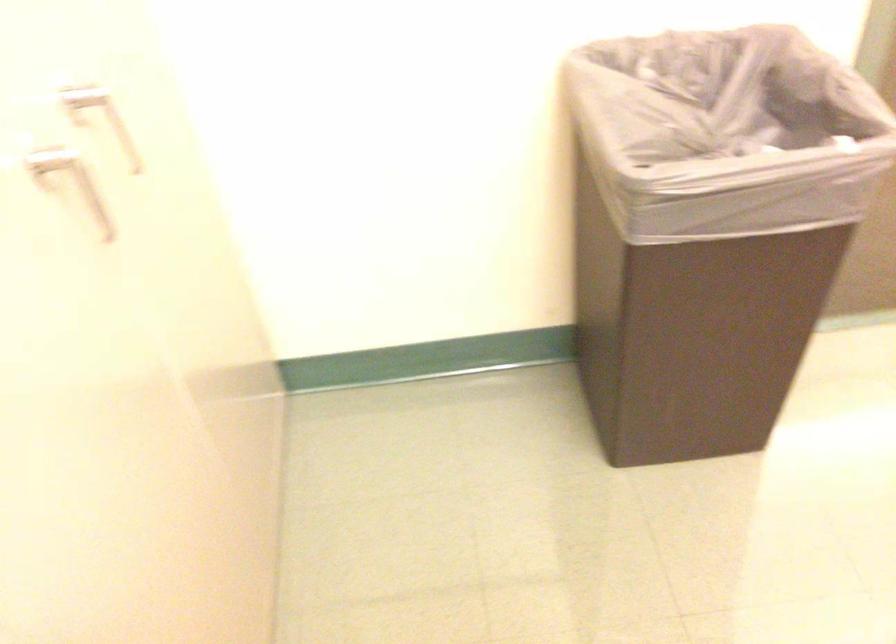
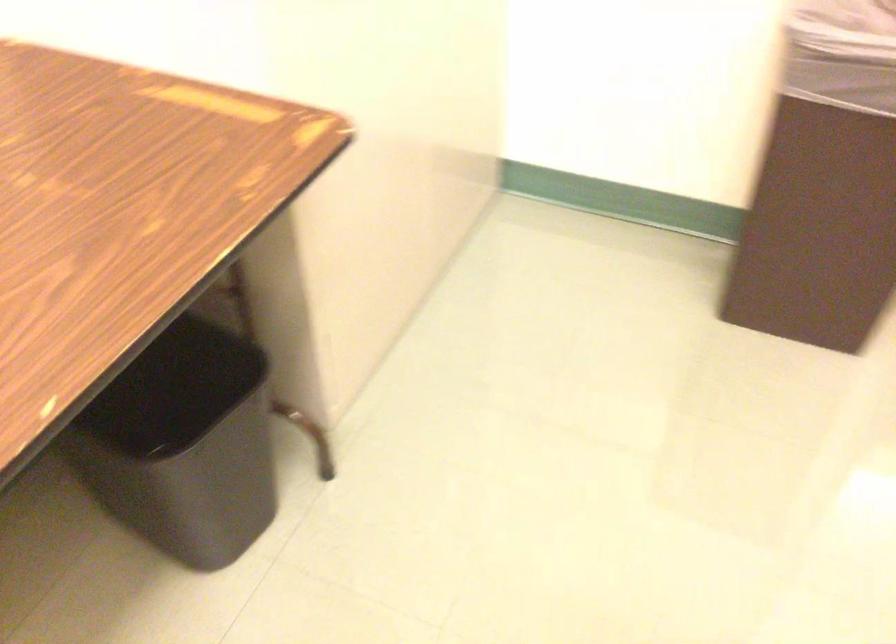
Question: The camera is either moving clockwise (left) or counter-clockwise (right) around the object. The first image is from the beginning of the video and the second image is from the end. Is the camera moving left or right when shooting the video?

Choices:
 (A) Left
 (B) Right

Answer: (B)